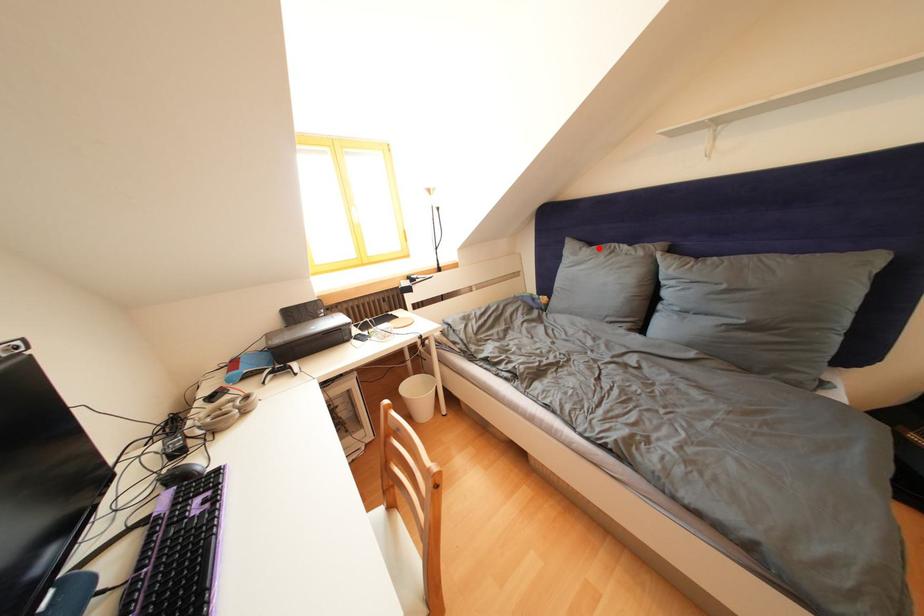
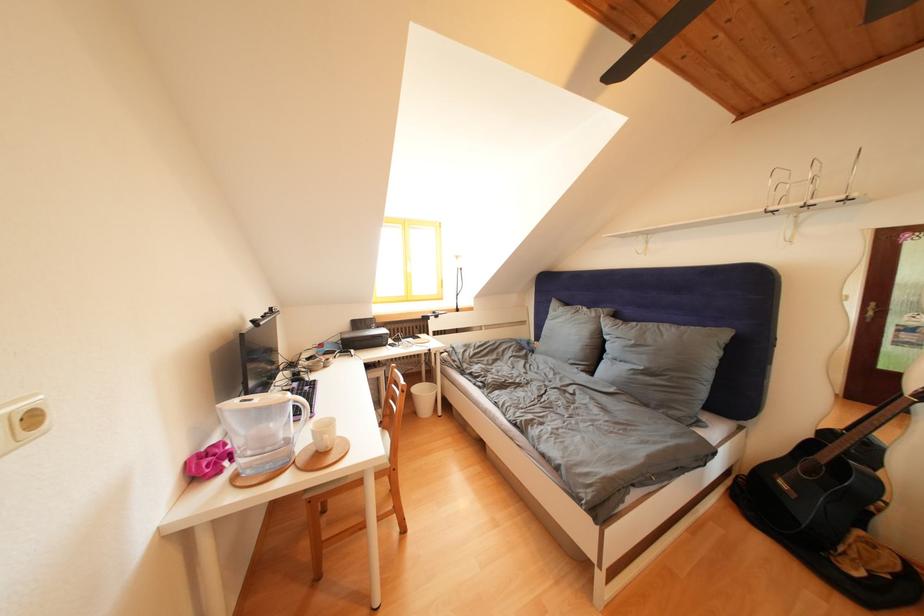
Find the pixel in the second image that matches the highlighted location in the first image.

(575, 310)